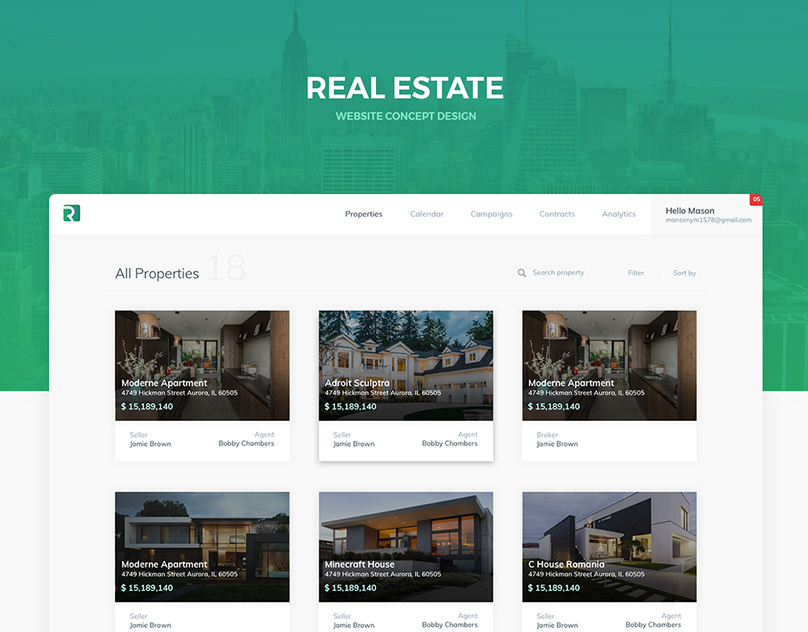
This screenshot has width=808, height=632. What are the coordinates of `apartments` in the screenshot? It's located at (196, 365), (604, 361), (191, 533).